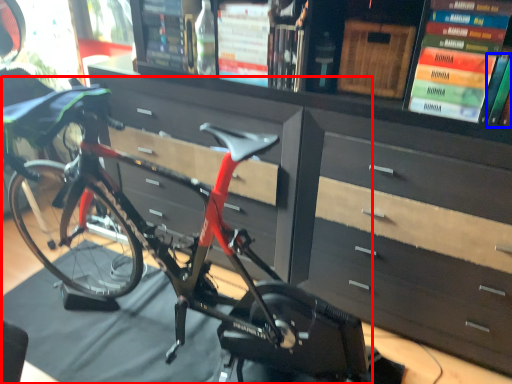
Question: Among these objects, which one is farthest to the camera, bicycle (highlighted by a red box) or book (highlighted by a blue box)?

Choices:
 (A) bicycle
 (B) book

Answer: (B)